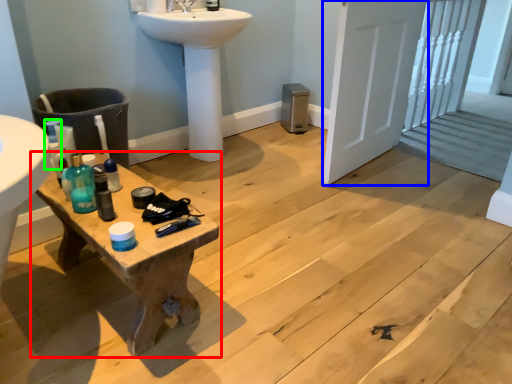
Question: Which object is the closest to the table (highlighted by a red box)? Choose among these: screen door (highlighted by a blue box) or bottle (highlighted by a green box).

Choices:
 (A) screen door
 (B) bottle

Answer: (B)